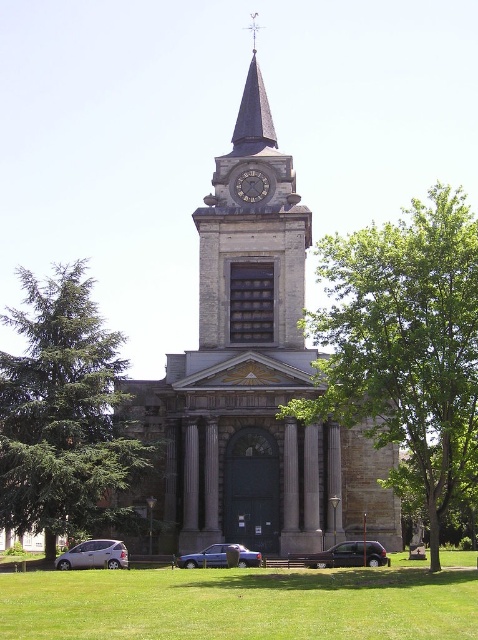
Question: Which object appears closest to the camera in this image?

Choices:
 (A) matte blue sedan at center
 (B) green needle-like leaves at left
 (C) silver metallic hatchback at lower left
 (D) dark gray stone clock at center

Answer: (B)

Question: Is green leafy tree at center positioned at the back of metallic silver van at center?

Choices:
 (A) no
 (B) yes

Answer: (A)

Question: In this image, where is stone church at center located relative to green needle-like leaves at left?

Choices:
 (A) above
 (B) below

Answer: (A)

Question: Can you confirm if green leafy tree at center is positioned below stone clock tower at center?

Choices:
 (A) no
 (B) yes

Answer: (B)

Question: Which is farther from the green grass at lower center?

Choices:
 (A) green needle-like leaves at left
 (B) silver metallic hatchback at lower left
 (C) dark gray stone clock at center
 (D) matte blue sedan at center

Answer: (C)

Question: Which of the following is the closest to the observer?

Choices:
 (A) silver metallic hatchback at lower left
 (B) green grass at lower center
 (C) dark gray stone clock at center

Answer: (B)